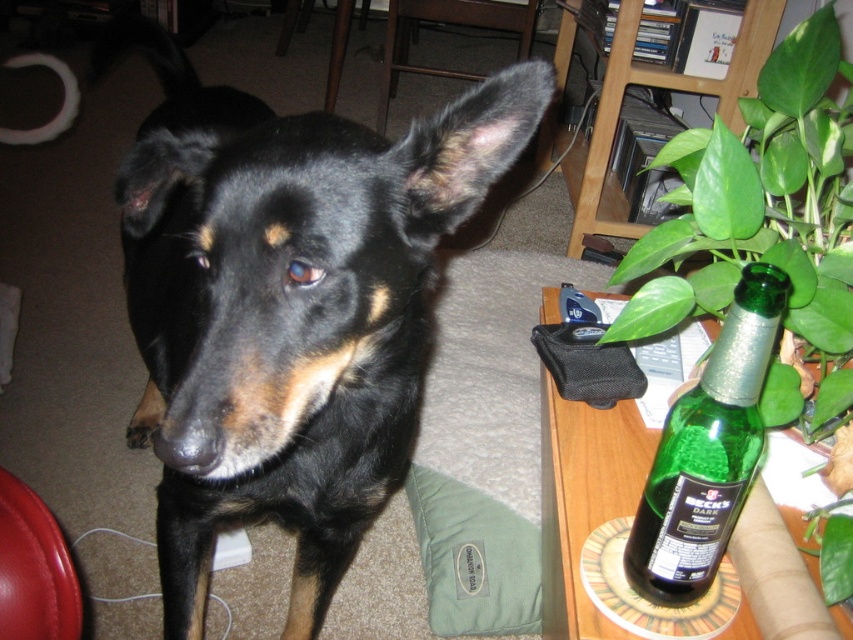
You are a dog trainer assessing the space for a new dog. The black shiny fur dog at center and the green leafy plant at right are in the room. Based on their sizes, which one do you think occupies more horizontal space?

The black shiny fur dog at center occupies more horizontal space because its width is larger than that of the green leafy plant at right.